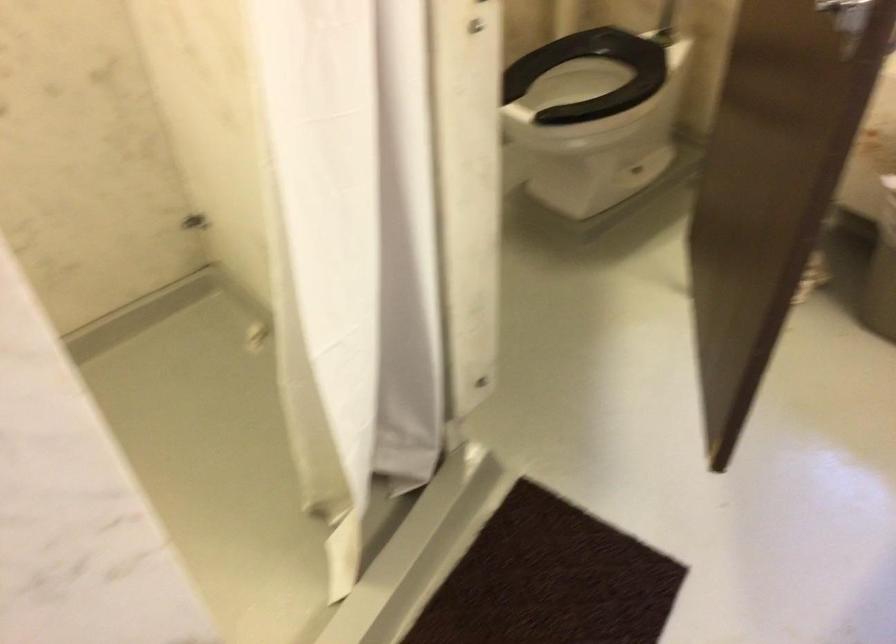
I want to click on black toilet seat, so click(591, 75).